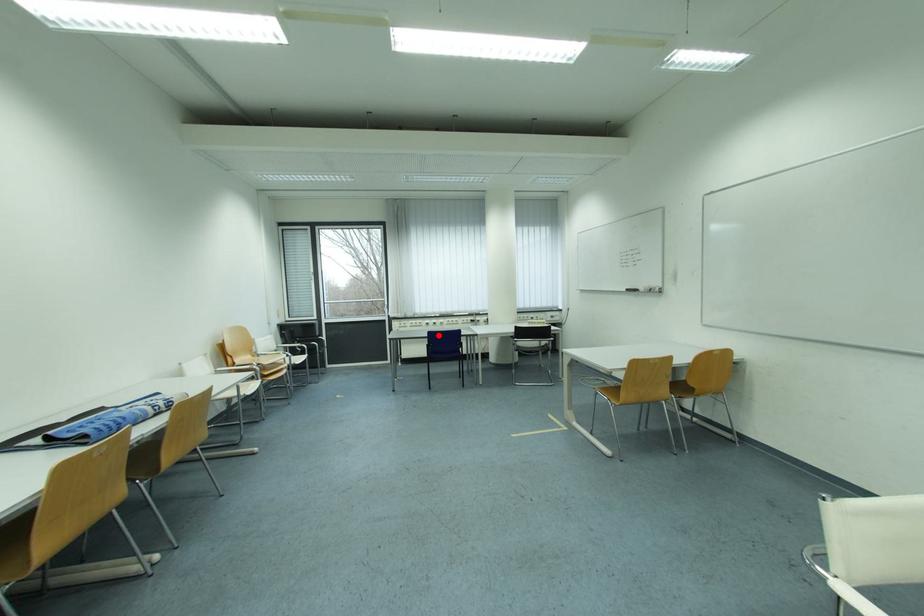
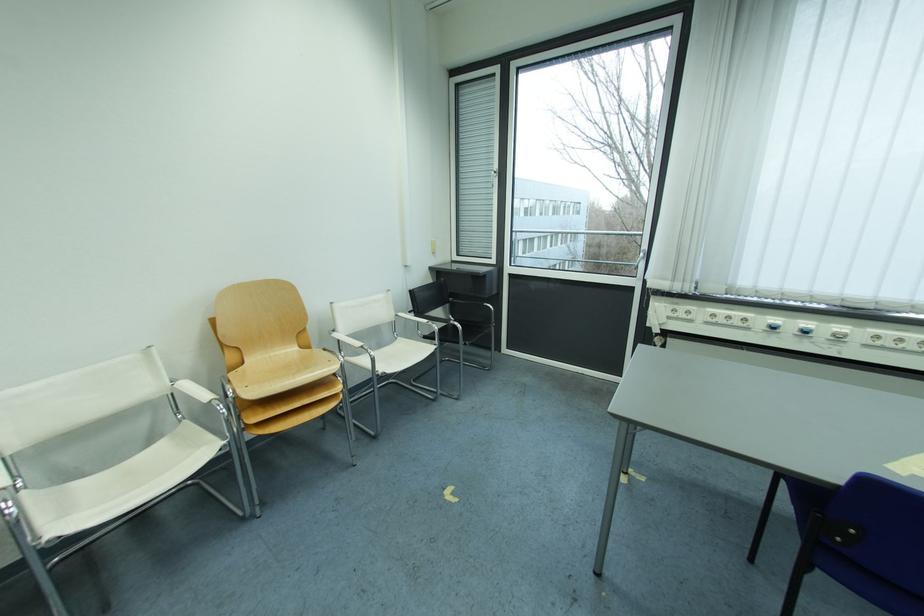
In the second image, find the point that corresponds to the highlighted location in the first image.

(883, 490)